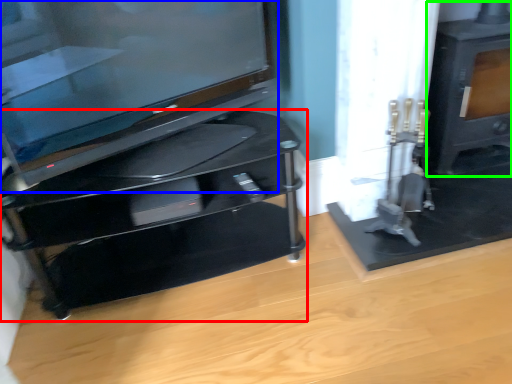
Question: Based on their relative distances, which object is farther from furniture (highlighted by a red box)? Choose from television (highlighted by a blue box) and stove (highlighted by a green box).

Choices:
 (A) television
 (B) stove

Answer: (B)